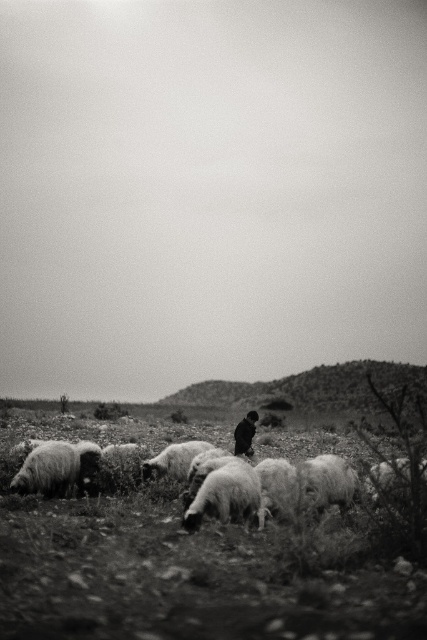
Looking at this image, can you confirm if fluffy white sheep at center is positioned above fluffy white wool at lower center?

No, fluffy white sheep at center is not above fluffy white wool at lower center.

Does fluffy white sheep at center have a greater width compared to fluffy white wool at lower center?

Correct, the width of fluffy white sheep at center exceeds that of fluffy white wool at lower center.

Which is behind, point (274, 468) or point (316, 497)?

The point (274, 468) is behind.

Identify the location of fluffy white sheep at center. (254, 472).

Who is lower down, fluffy white wool at lower center or fluffy white wool at center?

fluffy white wool at lower center

I want to click on fluffy white wool at lower center, so click(x=327, y=481).

Is point (318, 493) behind point (280, 461)?

No, (318, 493) is in front of (280, 461).

This screenshot has height=640, width=427. I want to click on fluffy white wool at lower center, so click(327, 481).

Is point (256, 506) closer to viewer compared to point (290, 467)?

Yes, it is in front of point (290, 467).

Between point (198, 480) and point (263, 504), which one is positioned behind?

Point (198, 480)

Does point (198, 486) come behind point (269, 500)?

Yes, point (198, 486) is behind point (269, 500).

Identify the location of fuzzy woolly sheep at center. (222, 492).